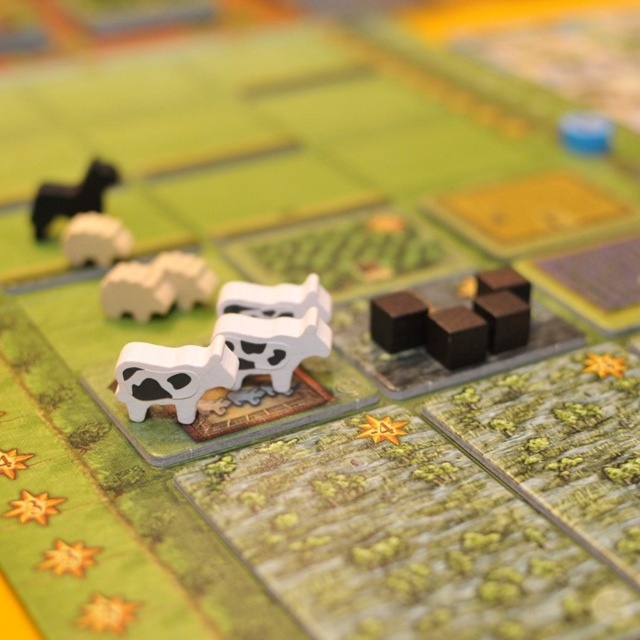
Is point (305, 356) in front of point (499, 326)?

Yes.

Is white matte cow at center taller than shiny dark brown cubes at center right?

Yes, white matte cow at center is taller than shiny dark brown cubes at center right.

The width and height of the screenshot is (640, 640). I want to click on white matte cow at center, so click(228, 348).

Identify the location of white matte cow at center. The image size is (640, 640). (228, 348).

Where is `white matte cow at center`? This screenshot has height=640, width=640. white matte cow at center is located at coordinates (228, 348).

Between shiny dark brown cubes at center right and white matte cow at upper left, which one has less height?

white matte cow at upper left

Which is below, shiny dark brown cubes at center right or white matte cow at upper left?

shiny dark brown cubes at center right is below.

The height and width of the screenshot is (640, 640). What are the coordinates of `shiny dark brown cubes at center right` in the screenshot? It's located at (456, 321).